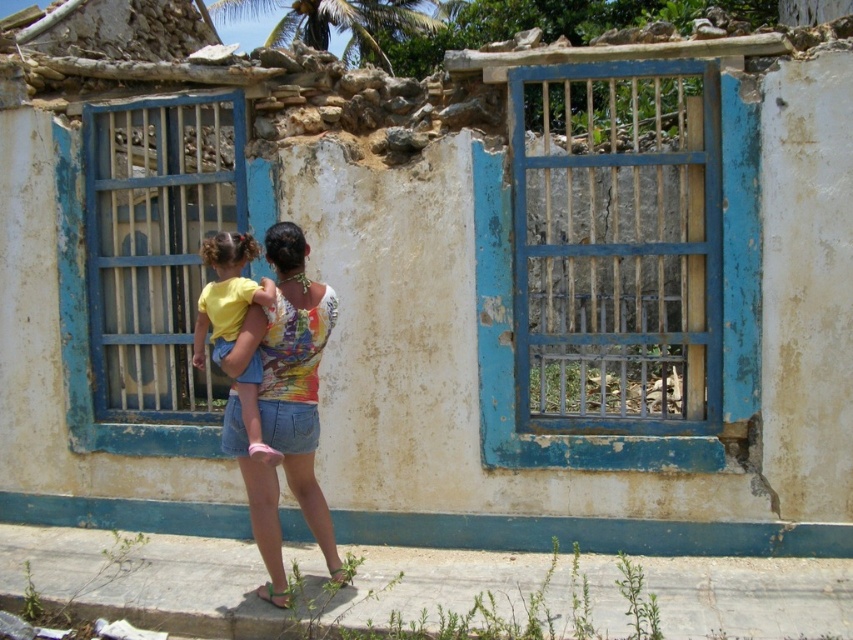
Question: Is multicolored printed tank top at center above yellow cotton shirt at center?

Choices:
 (A) yes
 (B) no

Answer: (B)

Question: Observing the image, what is the correct spatial positioning of multicolored printed tank top at center in reference to yellow cotton shirt at center?

Choices:
 (A) left
 (B) right

Answer: (B)

Question: Among these objects, which one is nearest to the camera?

Choices:
 (A) yellow cotton shirt at center
 (B) multicolored printed tank top at center

Answer: (A)

Question: Can you confirm if multicolored printed tank top at center is positioned to the left of yellow cotton shirt at center?

Choices:
 (A) yes
 (B) no

Answer: (B)

Question: Which object appears farthest from the camera in this image?

Choices:
 (A) multicolored printed tank top at center
 (B) yellow cotton shirt at center

Answer: (A)